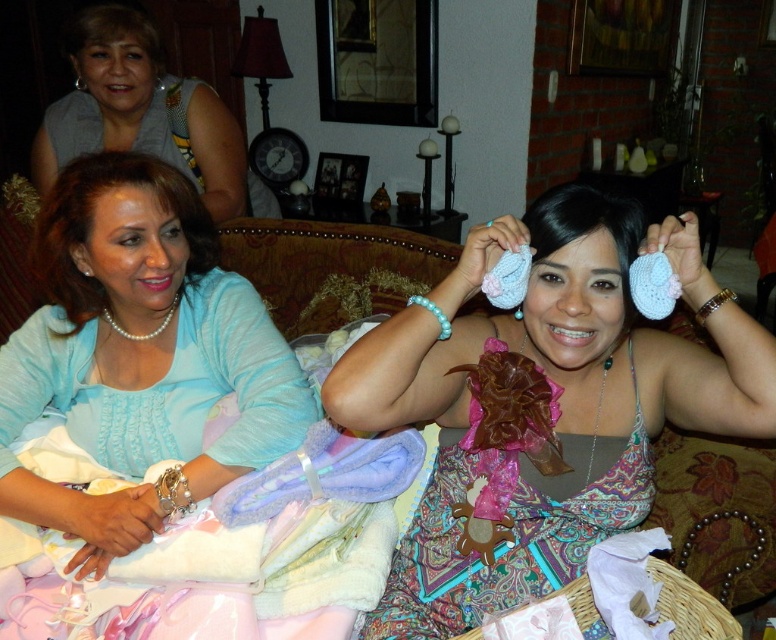
Question: Which of the following is the farthest from the observer?

Choices:
 (A) (196, 112)
 (B) (179, 230)
 (C) (560, 189)

Answer: (A)

Question: Is matte pink crochet booties at center above matte gray blouse at upper left?

Choices:
 (A) yes
 (B) no

Answer: (B)

Question: Among these points, which one is farthest from the camera?

Choices:
 (A) [x=61, y=109]
 (B) [x=570, y=429]
 (C) [x=168, y=481]

Answer: (A)

Question: Among these points, which one is farthest from the camera?

Choices:
 (A) (130, 26)
 (B) (113, 356)
 (C) (404, 321)

Answer: (A)

Question: Does matte pink crochet booties at center have a smaller size compared to matte blue sweater at left?

Choices:
 (A) no
 (B) yes

Answer: (A)

Question: Is matte blue sweater at left thinner than matte gray blouse at upper left?

Choices:
 (A) yes
 (B) no

Answer: (A)